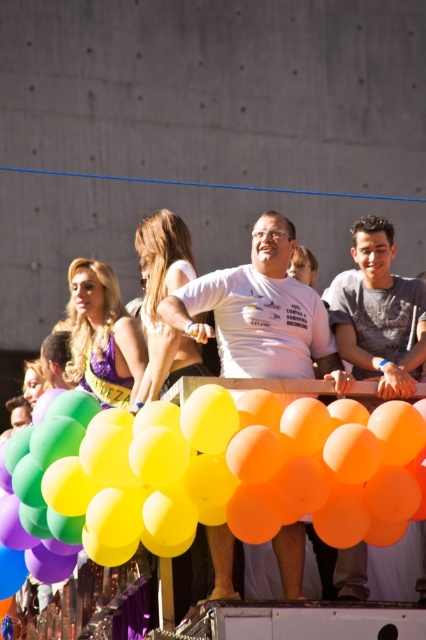
Is white matte shirt at center thinner than shiny purple dress at center?

No.

Identify the location of white matte shirt at center. (261, 314).

The image size is (426, 640). I want to click on white matte shirt at center, so click(x=261, y=314).

Is rubber balloons at center to the right of white matte shirt at center from the viewer's perspective?

Incorrect, rubber balloons at center is not on the right side of white matte shirt at center.

Who is more forward, (x=199, y=509) or (x=256, y=317)?

Point (x=199, y=509)

The width and height of the screenshot is (426, 640). Identify the location of rubber balloons at center. (239, 472).

Is rubber balloons at center thinner than shiny purple dress at center?

No, rubber balloons at center is not thinner than shiny purple dress at center.

Does point (345, 454) lie in front of point (77, 380)?

Yes, point (345, 454) is in front of point (77, 380).

In order to click on rubber balloons at center in this screenshot , I will do `click(239, 472)`.